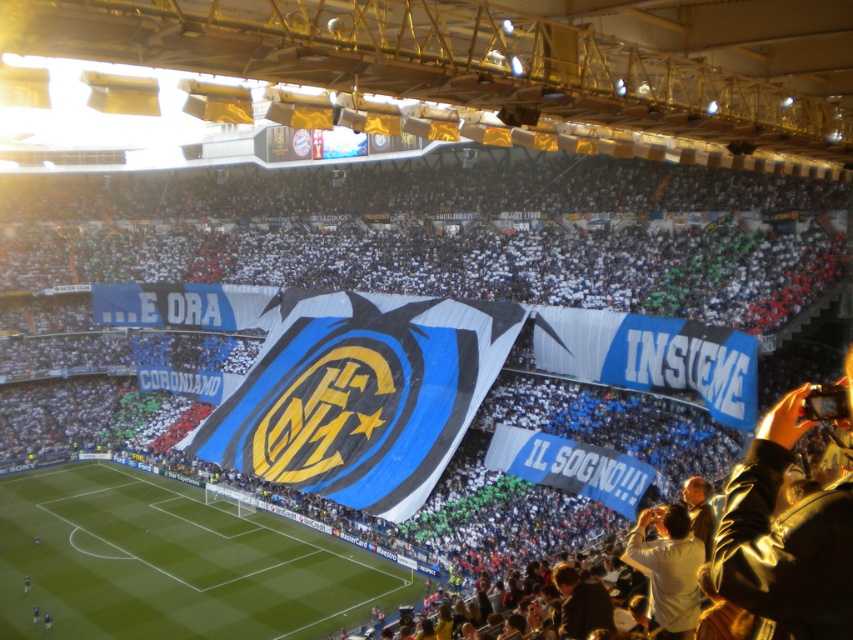
Can you confirm if green grass football field at center is positioned above white matte shirt at lower right?

No.

Can you confirm if green grass football field at center is shorter than white matte shirt at lower right?

No, green grass football field at center is not shorter than white matte shirt at lower right.

Is point (71, 579) positioned in front of point (671, 570)?

That is False.

I want to click on green grass football field at center, so click(x=171, y=563).